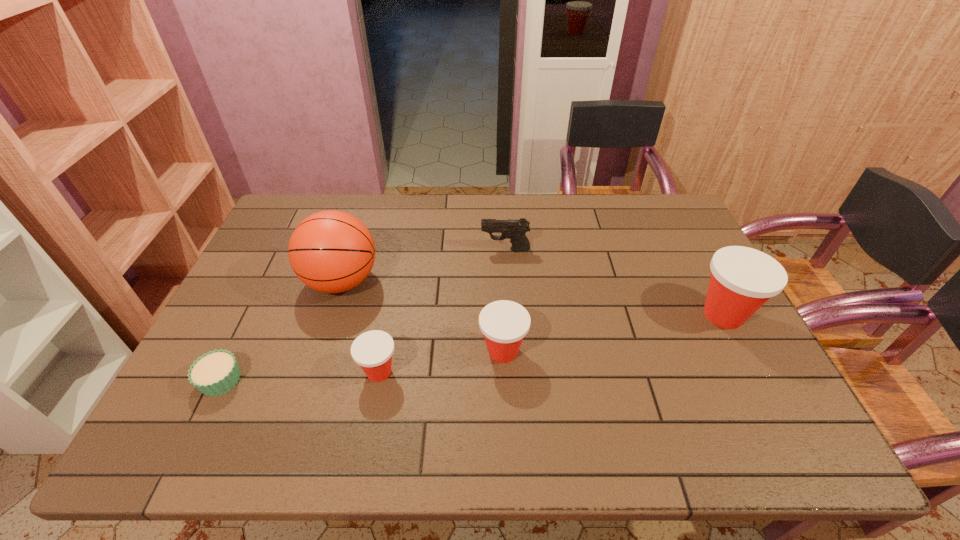
Where is `free space between the second shortest Dixie cup and the tallest object`? free space between the second shortest Dixie cup and the tallest object is located at coordinates (422, 316).

You are a GUI agent. You are given a task and a screenshot of the screen. Output one action in this format:
    pyautogui.click(x=<x>, y=<y>)
    Task: Click on the vacant point located between the second shortest Dixie cup and the shortest Dixie cup
    This screenshot has height=540, width=960.
    Given the screenshot: What is the action you would take?
    pyautogui.click(x=441, y=362)

This screenshot has width=960, height=540. I want to click on vacant area that lies between the basketball and the second shortest object, so click(360, 327).

Locate an element on the screen. This screenshot has width=960, height=540. empty space between the second Dixie cup from left to right and the tallest object is located at coordinates (422, 316).

Locate an element on the screen. This screenshot has width=960, height=540. object that can be found as the fourth closest to the leftmost Dixie cup is located at coordinates (514, 229).

You are a GUI agent. You are given a task and a screenshot of the screen. Output one action in this format:
    pyautogui.click(x=<x>, y=<y>)
    Task: Click on the object that is the third closest to the rightmost Dixie cup
    This screenshot has height=540, width=960.
    Given the screenshot: What is the action you would take?
    pyautogui.click(x=372, y=350)

Identify which Dixie cup is the closest to the farthest object. Please provide its 2D coordinates. Your answer should be formatted as a tuple, i.e. [(x, y)], where the tuple contains the x and y coordinates of a point satisfying the conditions above.

[(504, 323)]

Where is `Dixie cup that is the closest one to the fifth shortest object`? Dixie cup that is the closest one to the fifth shortest object is located at coordinates (504, 323).

You are a GUI agent. You are given a task and a screenshot of the screen. Output one action in this format:
    pyautogui.click(x=<x>, y=<y>)
    Task: Click on the vacant position in the image that satisfies the following two spatial constraints: 1. at the barrel of the farthest object; 2. on the front side of the shortest object
    
    Given the screenshot: What is the action you would take?
    pyautogui.click(x=514, y=380)

The height and width of the screenshot is (540, 960). I want to click on free space that satisfies the following two spatial constraints: 1. on the back side of the second tallest Dixie cup; 2. on the right side of the leftmost Dixie cup, so click(383, 352).